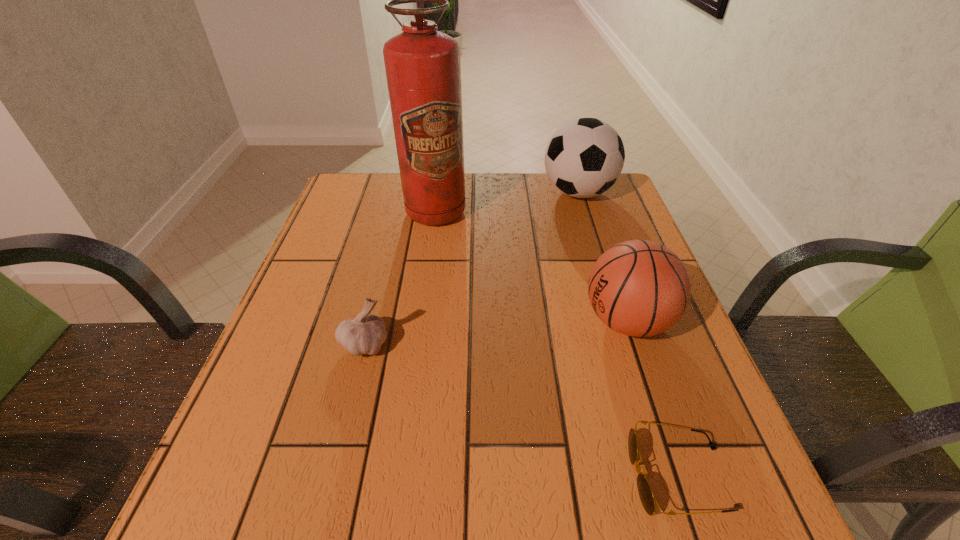
Identify the location of free location that satisfies the following two spatial constraints: 1. on the surface of the basketball near the brand logo; 2. on the front side of the garlic. The width and height of the screenshot is (960, 540). (636, 345).